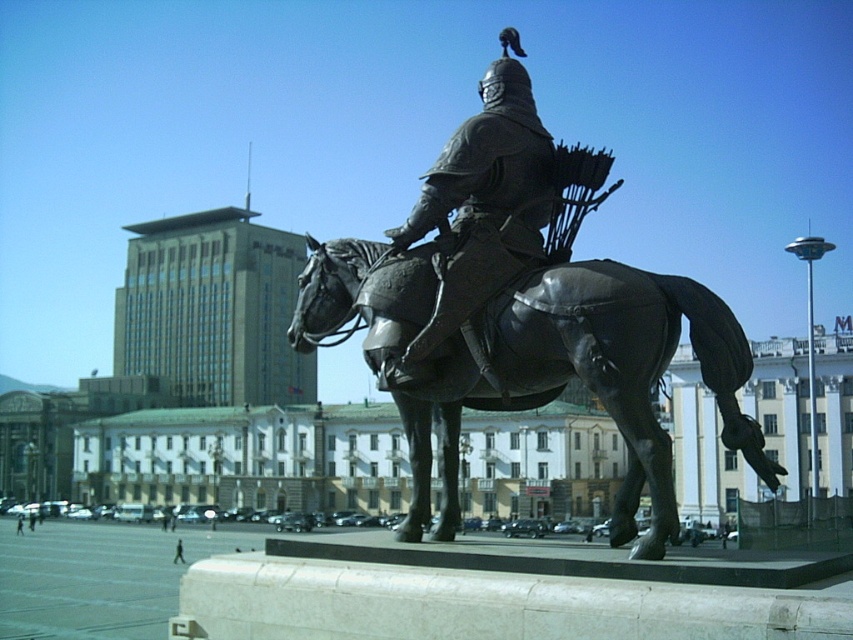
Question: Which point is closer to the camera?

Choices:
 (A) bronze statue at center
 (B) polished bronze statue at center

Answer: (A)

Question: Does bronze statue at center lie in front of polished bronze statue at center?

Choices:
 (A) no
 (B) yes

Answer: (B)

Question: Which object appears closest to the camera in this image?

Choices:
 (A) polished bronze statue at center
 (B) bronze statue at center

Answer: (B)

Question: Is bronze statue at center smaller than polished bronze statue at center?

Choices:
 (A) yes
 (B) no

Answer: (B)

Question: Which object is closer to the camera taking this photo?

Choices:
 (A) bronze statue at center
 (B) polished bronze statue at center

Answer: (A)

Question: Is bronze statue at center behind polished bronze statue at center?

Choices:
 (A) no
 (B) yes

Answer: (A)